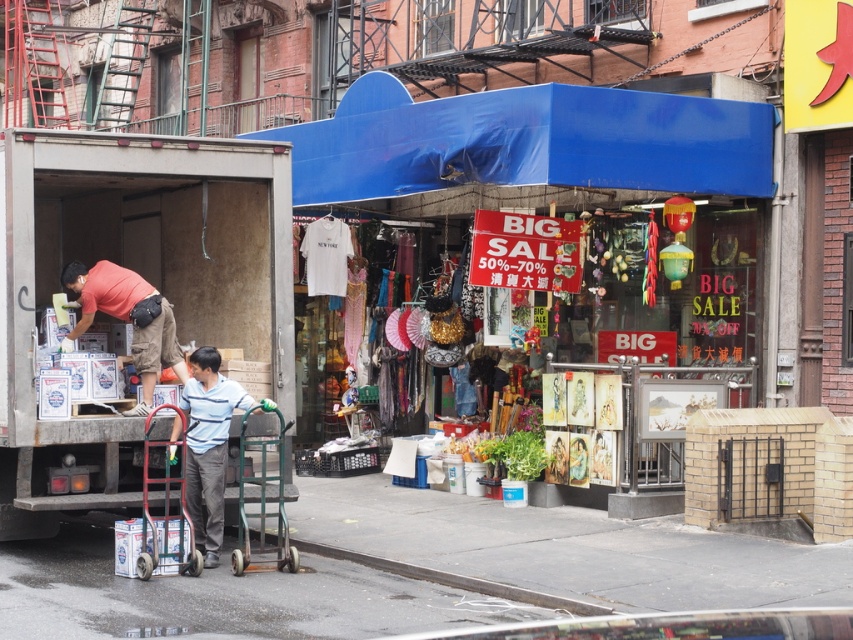
You are a delivery person who needs to place a package on the striped cotton shirt at center without moving the green metallic handcart at center. Is there enough space between them to do this?

The striped cotton shirt at center is 36.66 centimeters away from the green metallic handcart at center. Since the package requires minimal space to place, there is sufficient distance to position it without moving the handcart.

You are a delivery person standing at the store entrance. You need to deliver a package to the person wearing a red shirt at left located at point (x=128, y=317). Can you reach them without crossing the store display area?

The person wearing a red shirt at left is located at point (x=128, y=317). Since the store display area is behind the entrance, you can walk around the display to reach them safely.

What are the coordinates of the matte red shirt at left?

The coordinates of the matte red shirt at left are at point (128,317).